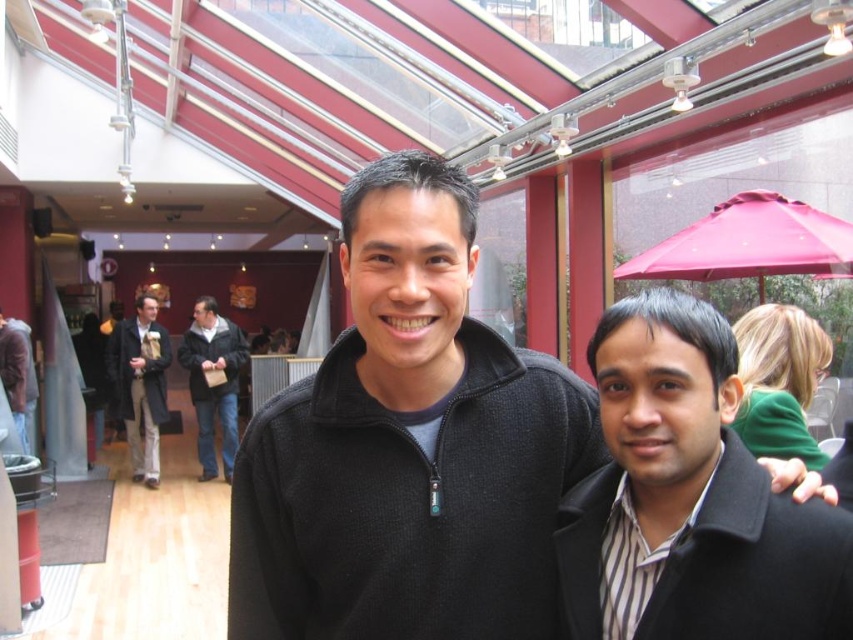
Question: Can you confirm if pink fabric canopy at upper right is positioned above dark brown leather coat at left?

Choices:
 (A) yes
 (B) no

Answer: (A)

Question: Which object is farther from the camera taking this photo?

Choices:
 (A) matte black jacket at left
 (B) pink fabric canopy at upper right
 (C) dark brown leather jacket at center

Answer: (C)

Question: Is striped fabric shirt at right bigger than pink fabric canopy at upper right?

Choices:
 (A) no
 (B) yes

Answer: (A)

Question: Estimate the real-world distances between objects in this image. Which object is farther from the striped fabric shirt at right?

Choices:
 (A) dark brown leather coat at left
 (B) dark brown leather jacket at center
 (C) pink fabric canopy at upper right

Answer: (A)

Question: Which point is farther from the camera taking this photo?

Choices:
 (A) (213, 332)
 (B) (630, 352)
 (C) (637, 268)
 (D) (138, 337)

Answer: (A)

Question: Does striped fabric shirt at right have a smaller size compared to dark brown leather jacket at center?

Choices:
 (A) yes
 (B) no

Answer: (A)